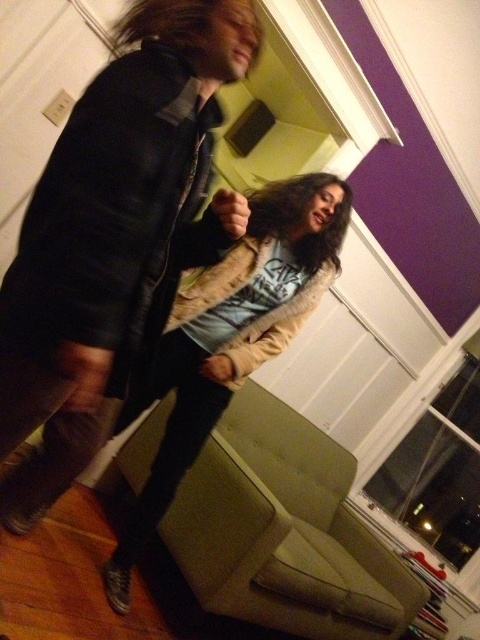
You are trying to decide which coat to wear today. You notice the black leather jacket at upper left and the fuzzy beige coat at center in the image. Which one is shorter?

The black leather jacket at upper left is shorter than the fuzzy beige coat at center.

You are standing in the living room and want to grab the fuzzy beige coat at center without moving the black leather jacket at upper left. Is there enough space between them to do so?

The black leather jacket at upper left is 20.23 inches away from the fuzzy beige coat at center, so yes, there is enough space to grab the fuzzy beige coat at center without moving the black leather jacket at upper left.

Based on the scene description, where is the black leather jacket at upper left located in terms of its 2D coordinates?

The black leather jacket at upper left is located at the 2D coordinates of point [117,230].